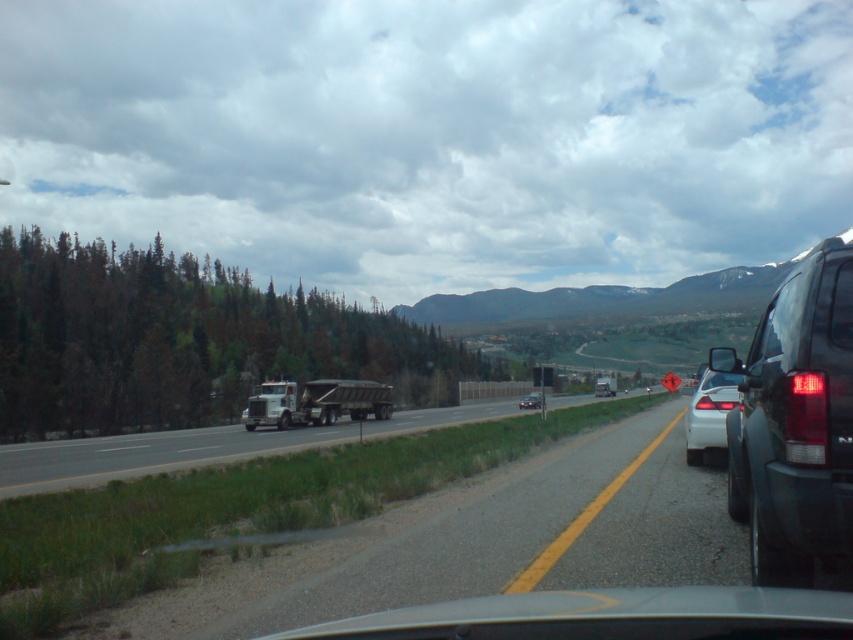
Question: Which object appears farthest from the camera in this image?

Choices:
 (A) matte black sedan at center
 (B) metallic silver truck at left
 (C) white matte sedan at right
 (D) clear glass windshield at right

Answer: (A)

Question: In this image, where is black glossy suv at right located relative to metallic silver truck at left?

Choices:
 (A) right
 (B) left

Answer: (A)

Question: Which of the following is the farthest from the observer?

Choices:
 (A) (822, 433)
 (B) (689, 413)
 (C) (804, 282)

Answer: (B)

Question: Is metallic silver truck at left further to camera compared to white matte sedan at right?

Choices:
 (A) no
 (B) yes

Answer: (B)

Question: Does clear glass windshield at right come in front of white matte sedan at right?

Choices:
 (A) no
 (B) yes

Answer: (B)

Question: Which of the following is the farthest from the observer?

Choices:
 (A) (776, 291)
 (B) (293, 417)
 (C) (709, 406)
 (D) (532, 401)

Answer: (D)